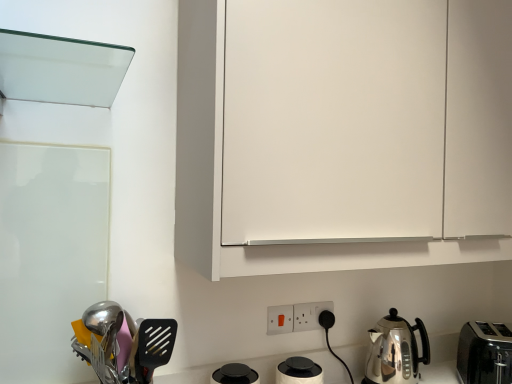
Question: Is polished stainless steel utensils at lower left a part of white plastic electric outlet at lower center, the first electric outlet when ordered from right to left?

Choices:
 (A) no
 (B) yes

Answer: (A)

Question: Considering the relative positions of white plastic electric outlet at lower center, the 1th electric outlet viewed from the back, and polished stainless steel utensils at lower left in the image provided, is white plastic electric outlet at lower center, the 1th electric outlet viewed from the back, to the right of polished stainless steel utensils at lower left from the viewer's perspective?

Choices:
 (A) yes
 (B) no

Answer: (A)

Question: From a real-world perspective, does white plastic electric outlet at lower center, the second electric outlet viewed from the left, stand above polished stainless steel utensils at lower left?

Choices:
 (A) yes
 (B) no

Answer: (A)

Question: Can you confirm if white plastic electric outlet at lower center, the first electric outlet when ordered from right to left, is taller than polished stainless steel utensils at lower left?

Choices:
 (A) no
 (B) yes

Answer: (A)

Question: From a real-world perspective, is white plastic electric outlet at lower center, the first electric outlet when ordered from right to left, physically below polished stainless steel utensils at lower left?

Choices:
 (A) yes
 (B) no

Answer: (B)

Question: Is white plastic electric outlet at lower center, the 1th electric outlet viewed from the back, wider than polished stainless steel utensils at lower left?

Choices:
 (A) no
 (B) yes

Answer: (A)

Question: Is polished stainless steel utensils at lower left not close to white plastic electric outlet at lower center, the 1th electric outlet from the front?

Choices:
 (A) no
 (B) yes

Answer: (A)

Question: Can you confirm if polished stainless steel utensils at lower left is shorter than white plastic electric outlet at lower center, the 1th electric outlet from the front?

Choices:
 (A) no
 (B) yes

Answer: (A)

Question: Is polished stainless steel utensils at lower left oriented away from white plastic electric outlet at lower center, the 1th electric outlet from the front?

Choices:
 (A) no
 (B) yes

Answer: (A)

Question: Considering the relative positions of polished stainless steel utensils at lower left and white plastic electric outlet at lower center, the second electric outlet viewed from the right, in the image provided, is polished stainless steel utensils at lower left behind white plastic electric outlet at lower center, the second electric outlet viewed from the right,?

Choices:
 (A) no
 (B) yes

Answer: (A)

Question: Can you confirm if polished stainless steel utensils at lower left is wider than white plastic electric outlet at lower center, which is the 1th electric outlet from left to right?

Choices:
 (A) no
 (B) yes

Answer: (B)

Question: Is white plastic electric outlet at lower center, the second electric outlet viewed from the right, a part of polished stainless steel utensils at lower left?

Choices:
 (A) yes
 (B) no

Answer: (B)

Question: Is white matte cabinet at upper center a part of satin silver kettle at lower right?

Choices:
 (A) yes
 (B) no

Answer: (B)